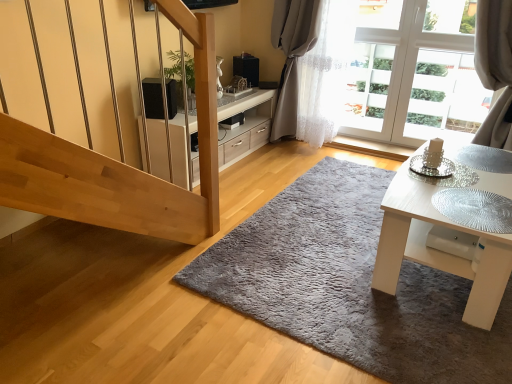
Question: Does white glossy table at lower right appear on the left side of black matte speaker at upper center?

Choices:
 (A) yes
 (B) no

Answer: (B)

Question: Is white glossy table at lower right taller than black matte speaker at upper center?

Choices:
 (A) yes
 (B) no

Answer: (A)

Question: Is white glossy table at lower right not close to black matte speaker at upper center?

Choices:
 (A) no
 (B) yes

Answer: (B)

Question: Is white glossy table at lower right turned away from black matte speaker at upper center?

Choices:
 (A) yes
 (B) no

Answer: (B)

Question: Considering the relative sizes of white glossy table at lower right and black matte speaker at upper center in the image provided, is white glossy table at lower right smaller than black matte speaker at upper center?

Choices:
 (A) no
 (B) yes

Answer: (A)

Question: Is white glossy table at lower right behind black matte speaker at upper center?

Choices:
 (A) no
 (B) yes

Answer: (A)

Question: Is black matte speaker at upper center located within white glossy cabinet at center?

Choices:
 (A) yes
 (B) no

Answer: (B)

Question: Is white glossy cabinet at center positioned in front of black matte speaker at upper center?

Choices:
 (A) no
 (B) yes

Answer: (B)

Question: Is black matte speaker at upper center at the back of white glossy cabinet at center?

Choices:
 (A) yes
 (B) no

Answer: (B)

Question: Is white glossy cabinet at center not inside black matte speaker at upper center?

Choices:
 (A) yes
 (B) no

Answer: (A)

Question: Is the depth of white glossy cabinet at center greater than that of black matte speaker at upper center?

Choices:
 (A) no
 (B) yes

Answer: (A)

Question: From a real-world perspective, does white glossy cabinet at center stand above black matte speaker at upper center?

Choices:
 (A) no
 (B) yes

Answer: (A)

Question: Does white sheer curtain at upper right come in front of gray fluffy rug at center?

Choices:
 (A) yes
 (B) no

Answer: (B)